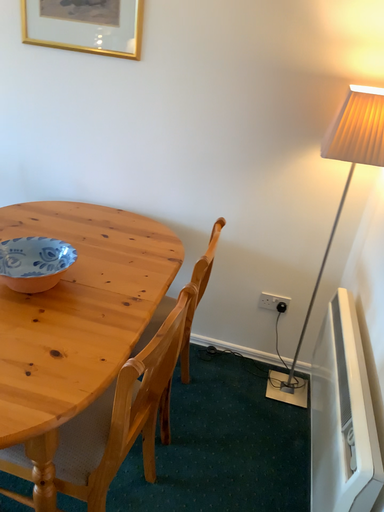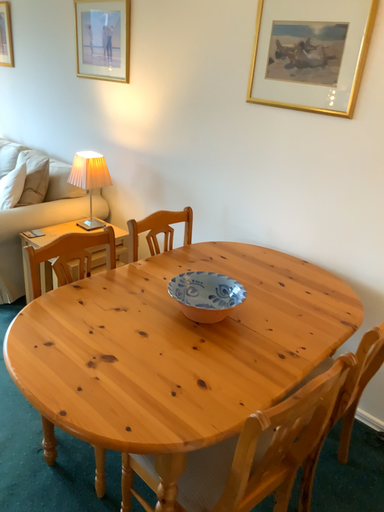
Question: How did the camera likely rotate when shooting the video?

Choices:
 (A) rotated right
 (B) rotated left

Answer: (B)